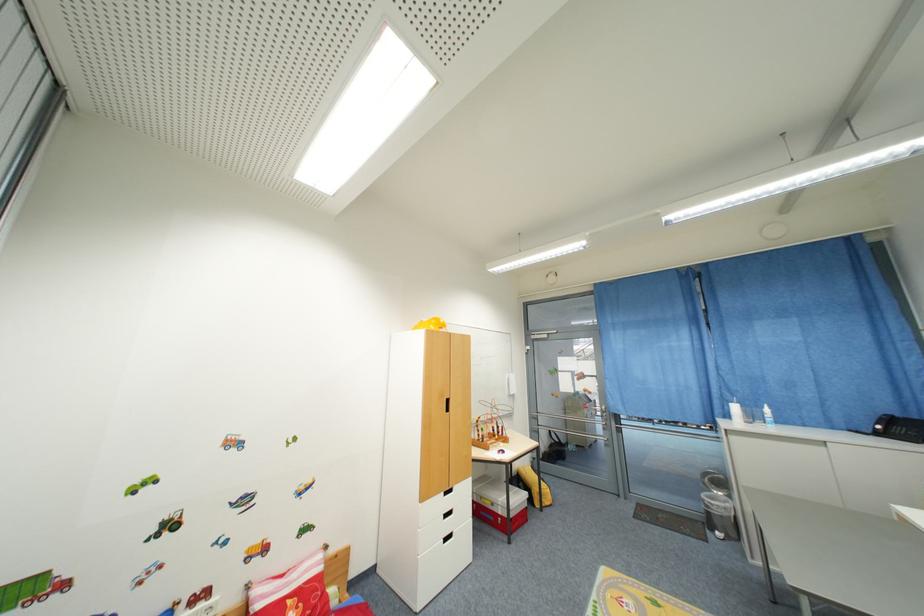
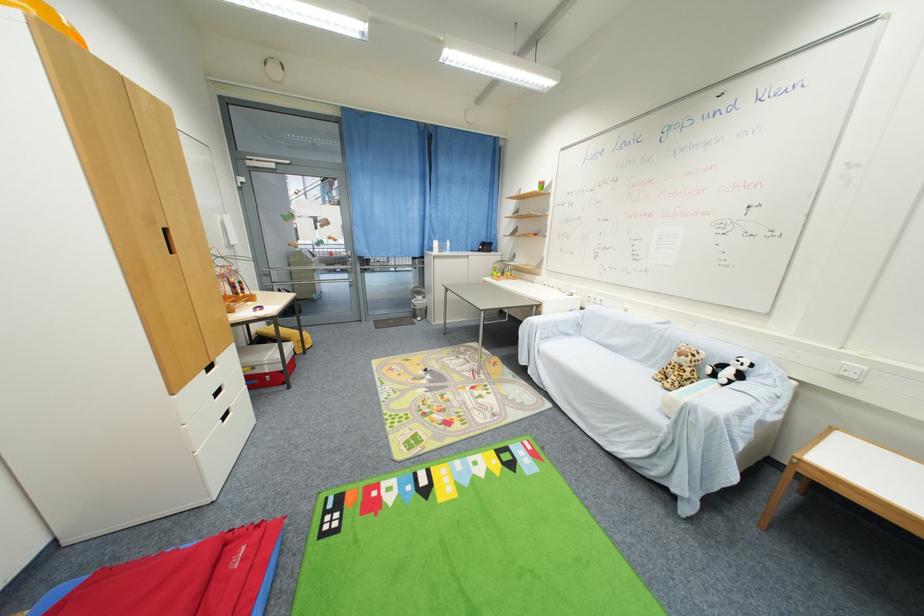
Locate, in the second image, the point that corresponds to (708,496) in the first image.

(418, 302)